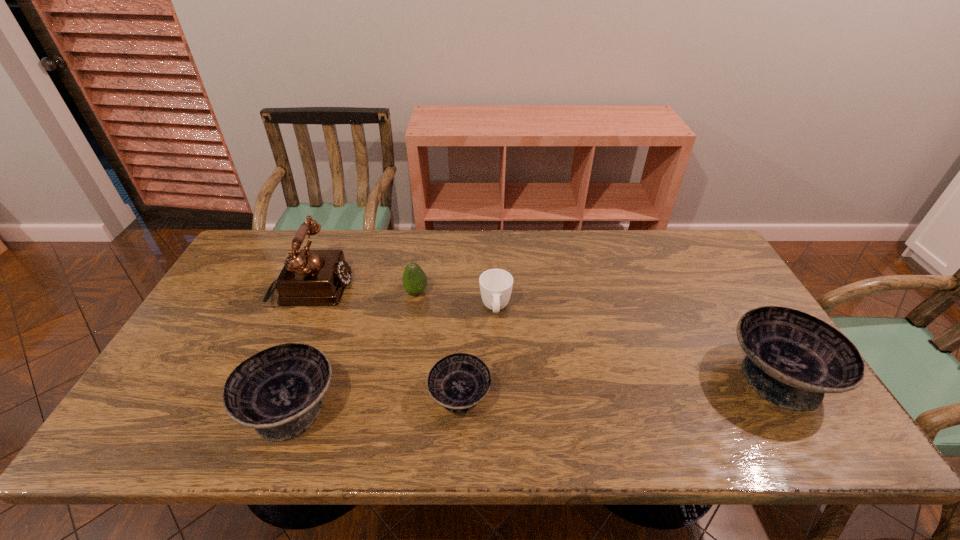
Locate an element on the screen. This screenshot has height=540, width=960. free space at the right edge of the desktop is located at coordinates (742, 360).

I want to click on free region at the far left corner of the desktop, so click(x=239, y=269).

Where is `vacant space at the near left corner`? The image size is (960, 540). vacant space at the near left corner is located at coordinates (198, 387).

At what (x,y) coordinates should I click in order to perform the action: click on blank space at the far right corner. Please return your answer as a coordinate pair (x, y). Looking at the image, I should click on (677, 250).

Identify the location of free point between the telephone and the shortest bowl. [386, 343].

This screenshot has height=540, width=960. I want to click on free space between the telephone and the avocado, so click(364, 291).

The width and height of the screenshot is (960, 540). What are the coordinates of `free spot between the cup and the third object from left to right` in the screenshot? It's located at (456, 301).

Where is `vacant area that lies between the telephone and the second bowl from left to right`? This screenshot has width=960, height=540. vacant area that lies between the telephone and the second bowl from left to right is located at coordinates (386, 343).

What are the coordinates of `empty location between the shortest object and the rightmost bowl` in the screenshot? It's located at (618, 386).

This screenshot has height=540, width=960. Identify the location of free spot between the second shortest bowl and the shortest bowl. (375, 402).